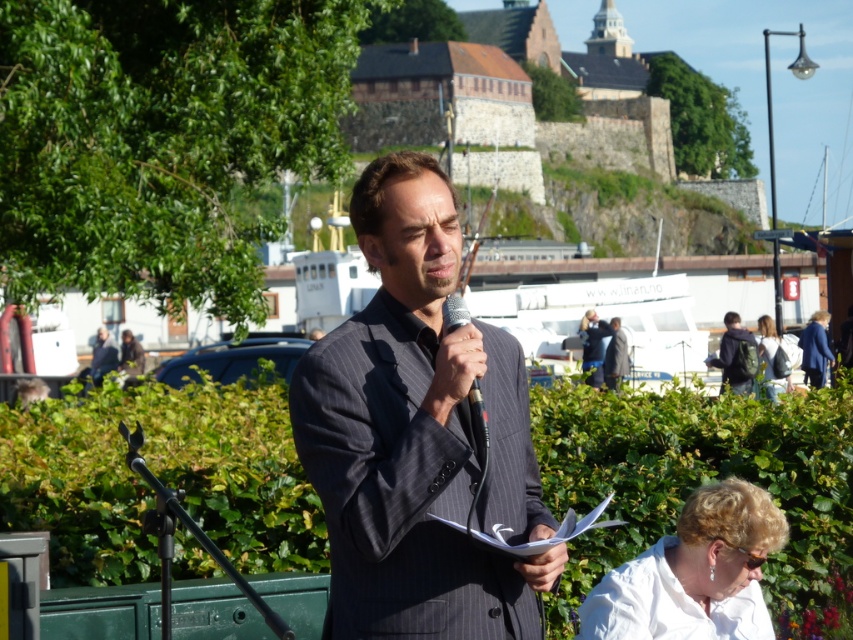
Is point (590, 376) positioned behind point (450, 296)?

Yes, it is.

At what (x,y) coordinates should I click in order to perform the action: click on dark blue suit at center. Please return your answer as a coordinate pair (x, y). Image resolution: width=853 pixels, height=640 pixels. Looking at the image, I should click on (593, 346).

Can you confirm if dark gray pinstripe suit at center is shorter than metallic silver microphone at center?

No.

Is dark gray pinstripe suit at center thinner than metallic silver microphone at center?

No.

Is point (410, 600) more distant than point (450, 305)?

No, it is not.

Where is `dark gray pinstripe suit at center`? The width and height of the screenshot is (853, 640). dark gray pinstripe suit at center is located at coordinates (418, 435).

This screenshot has width=853, height=640. What do you see at coordinates (454, 312) in the screenshot?
I see `metallic silver microphone at center` at bounding box center [454, 312].

Can you confirm if metallic silver microphone at center is positioned below dark gray suit at center?

Incorrect, metallic silver microphone at center is not positioned below dark gray suit at center.

Which is in front, point (468, 312) or point (613, 372)?

Positioned in front is point (468, 312).

The height and width of the screenshot is (640, 853). Identify the location of metallic silver microphone at center. (454, 312).